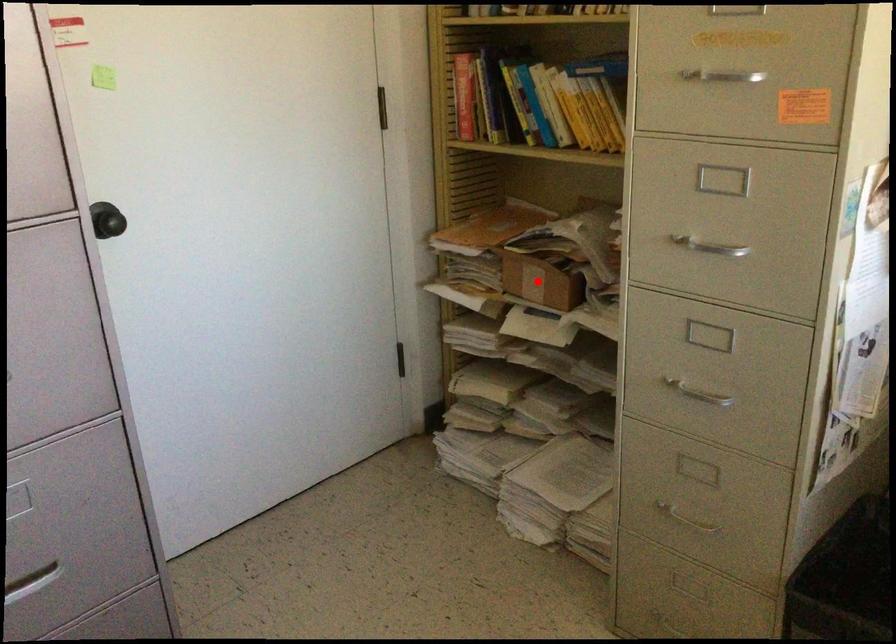
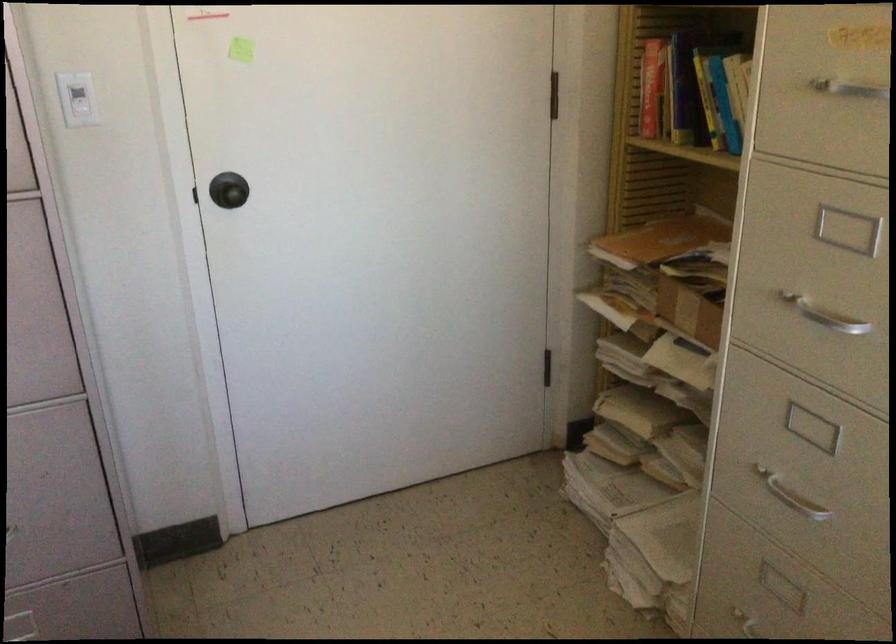
Question: A red point is marked in image1. In image2, is the corresponding 3D point closer to the camera or farther? Reply with the corresponding letter.

Choices:
 (A) The corresponding 3D point is closer.
 (B) The corresponding 3D point is farther.

Answer: (A)